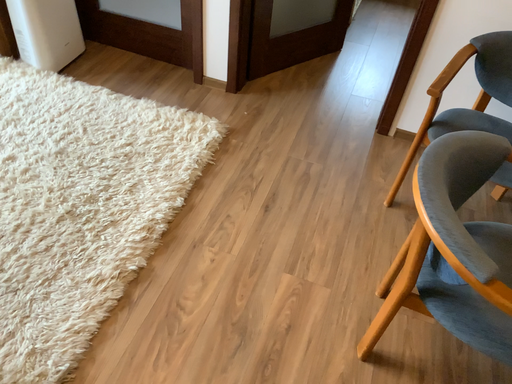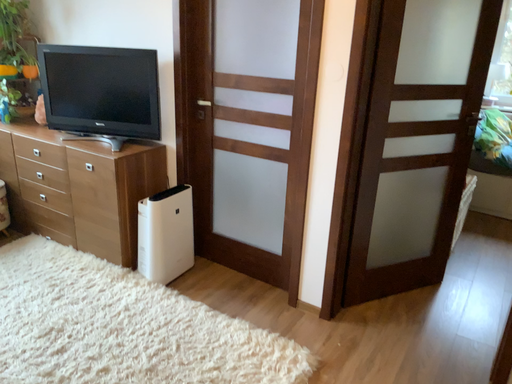
Question: Which way did the camera rotate in the video?

Choices:
 (A) rotated downward
 (B) rotated upward

Answer: (B)